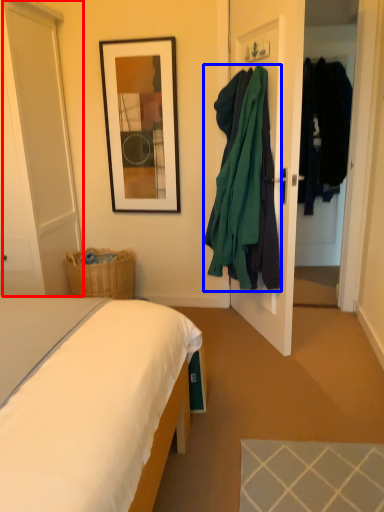
Question: Which of the following is the closest to the observer, glass door (highlighted by a red box) or clothing (highlighted by a blue box)?

Choices:
 (A) glass door
 (B) clothing

Answer: (B)